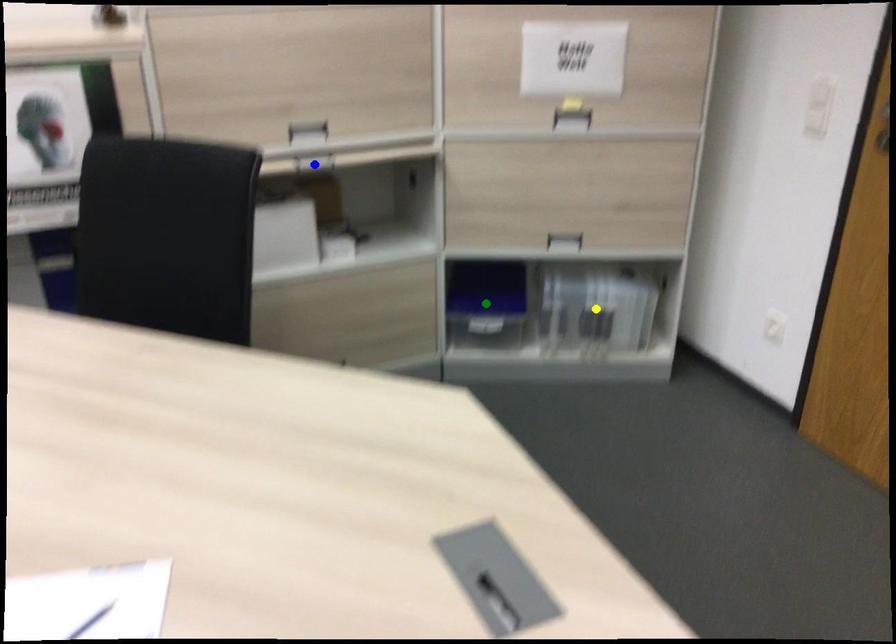
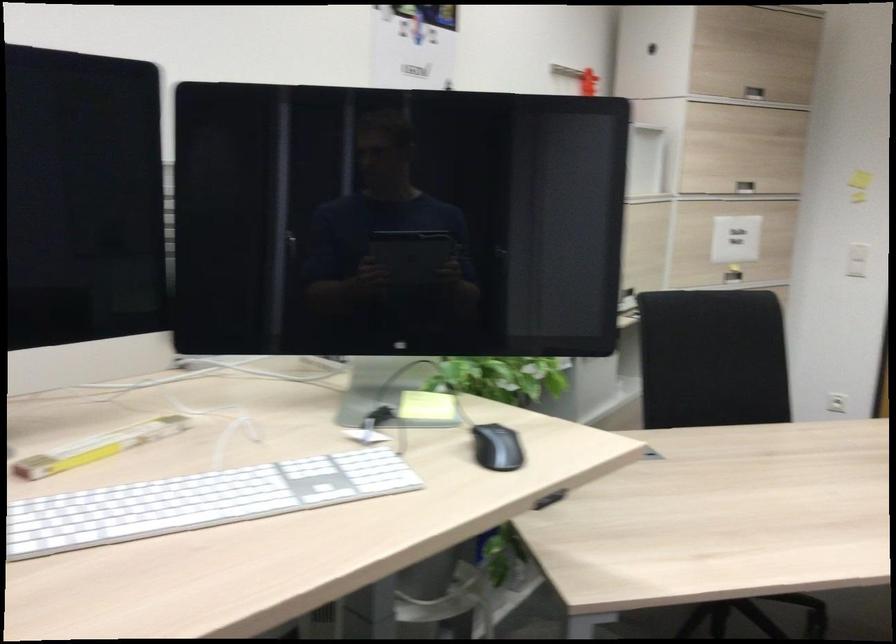
I am providing you with two images of the same scene from different viewpoints. Three points are marked in image1. Which point corresponds to a part or object that is occluded in image2?In image1, three points are marked. Which of them correspond to a part or object that is occluded in image2?Among the three points shown in image1, which one corresponds to a part or object that is no longer visible due to occlusion in image2?

green point, yellow point, blue point cannot be seen in image2.